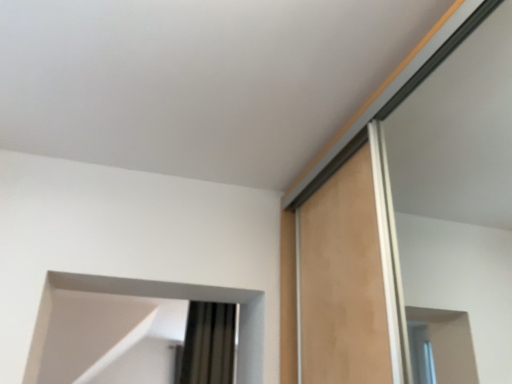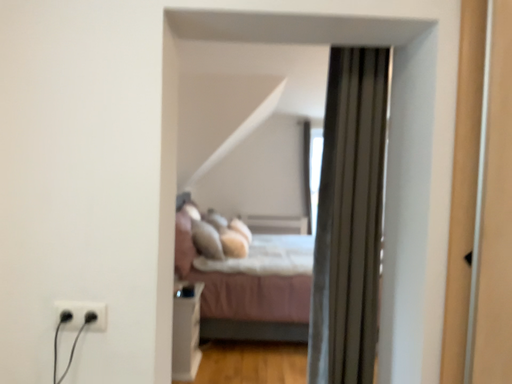
Question: Which way did the camera rotate in the video?

Choices:
 (A) rotated right
 (B) rotated left

Answer: (B)